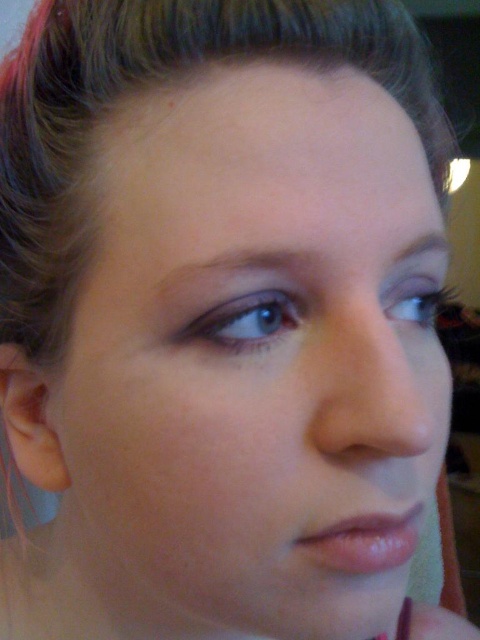
Question: Which object is closer to the camera taking this photo?

Choices:
 (A) blue matte eye at upper left
 (B) brown shiny hair at upper center

Answer: (A)

Question: In this image, where is brown shiny hair at upper center located relative to matte brown eye at center?

Choices:
 (A) below
 (B) above

Answer: (B)

Question: Which object appears closest to the camera in this image?

Choices:
 (A) shiny pink lipstick at lower center
 (B) matte brown eye at center
 (C) brown shiny hair at upper center
 (D) smooth skin face at center

Answer: (D)

Question: Does smooth skin face at center appear on the right side of blue matte eye at upper left?

Choices:
 (A) yes
 (B) no

Answer: (B)

Question: Can you confirm if brown shiny hair at upper center is positioned to the left of matte brown eye at center?

Choices:
 (A) no
 (B) yes

Answer: (B)

Question: Which is nearer to the brown shiny hair at upper center?

Choices:
 (A) blue matte eye at upper left
 (B) shiny pink lipstick at lower center

Answer: (A)